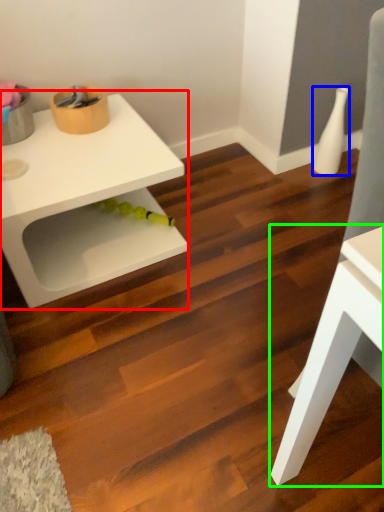
Question: Which object is positioned closest to table (highlighted by a red box)? Select from vase (highlighted by a blue box) and table (highlighted by a green box).

Choices:
 (A) vase
 (B) table

Answer: (B)